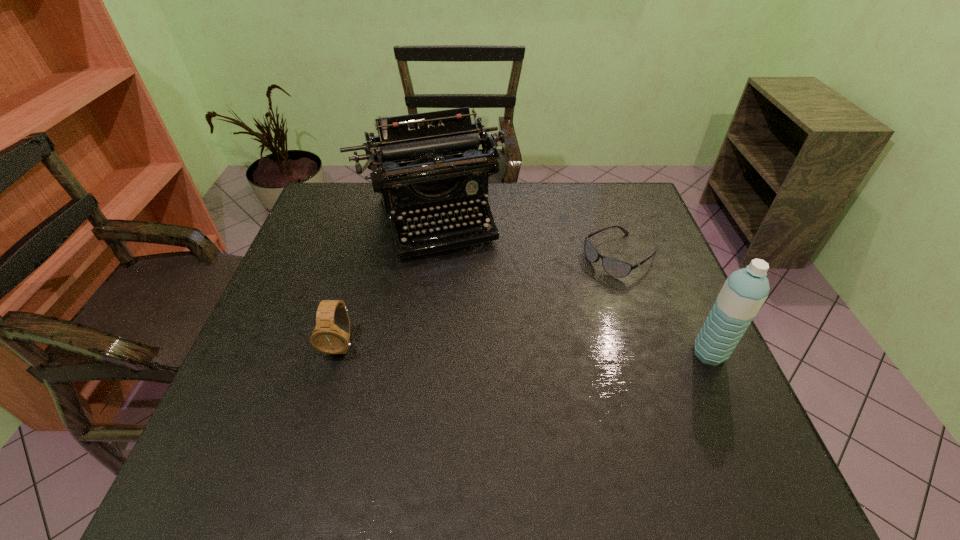
I want to click on free space on the desktop that is between the watch and the water bottle and is positioned on the lenses of the sunglasses, so click(479, 348).

You are a GUI agent. You are given a task and a screenshot of the screen. Output one action in this format:
    pyautogui.click(x=<x>, y=<y>)
    Task: Click on the free spot on the desktop that is between the second shortest object and the water bottle and is positioned on the keyboard of the typewriter
    The image size is (960, 540).
    Given the screenshot: What is the action you would take?
    pyautogui.click(x=474, y=348)